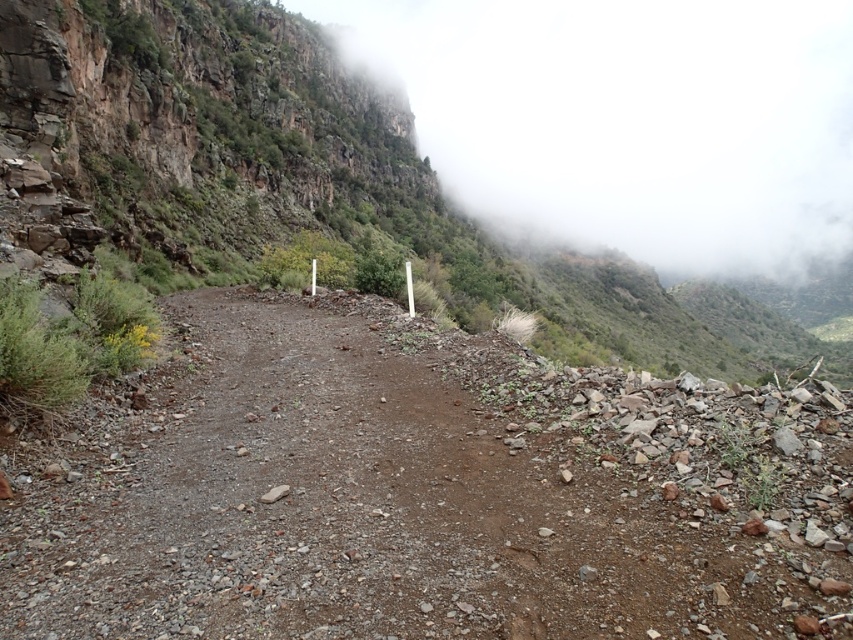
Which is in front, point (109, 406) or point (756, 189)?

Positioned in front is point (109, 406).

Which is more to the right, dull brown dirt track at center or foggy misty cliff at upper center?

foggy misty cliff at upper center is more to the right.

Between point (172, 605) and point (750, 225), which one is positioned behind?

Point (750, 225)

Where is `dull brown dirt track at center`? This screenshot has width=853, height=640. dull brown dirt track at center is located at coordinates (419, 492).